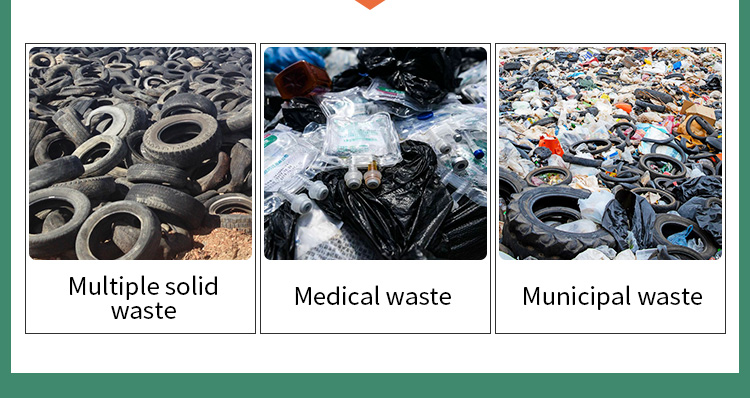
What are the coordinates of `trash` in the screenshot? It's located at (138, 148), (400, 141), (662, 125).